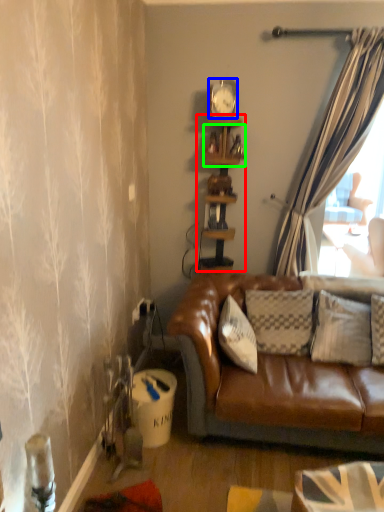
Question: Based on their relative distances, which object is nearer to shelf (highlighted by a red box)? Choose from clock (highlighted by a blue box) and shelf (highlighted by a green box).

Choices:
 (A) clock
 (B) shelf

Answer: (B)